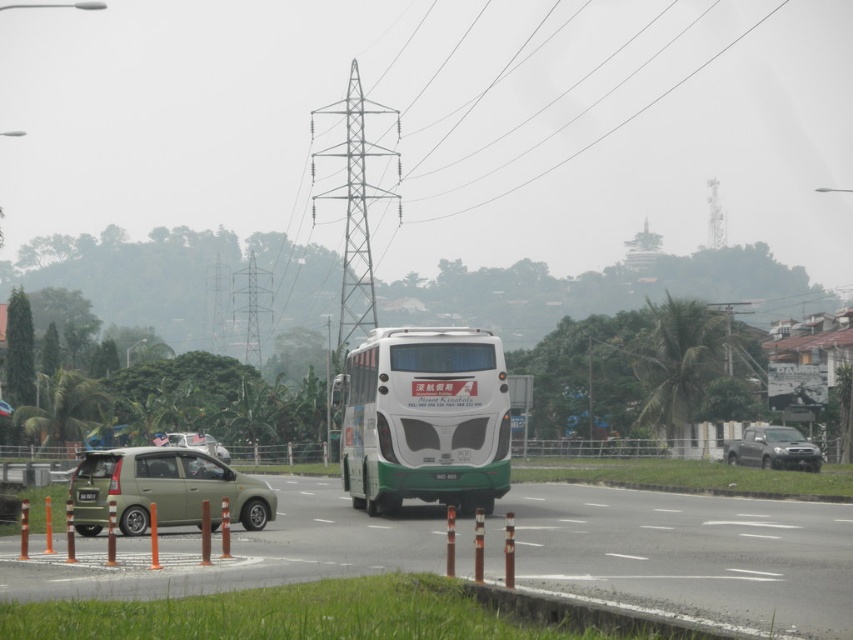
You are a pedestrian standing at the edge of the road. You see a matte green car at left and a smokey gray metallic truck at right. Which vehicle is taller?

The smokey gray metallic truck at right is taller than the matte green car at left.